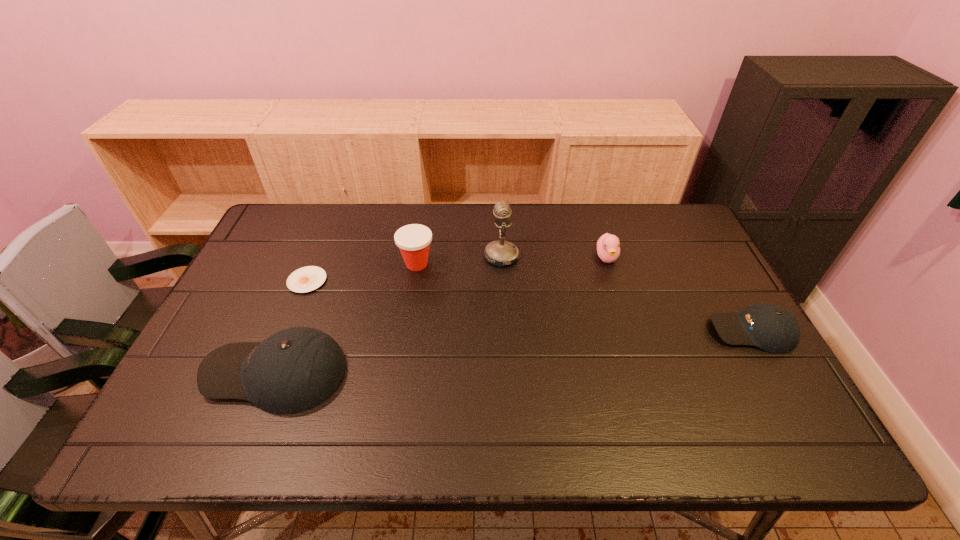
Locate an element on the screen. the left baseball cap is located at coordinates (296, 369).

The height and width of the screenshot is (540, 960). Identify the location of the rightmost object. (770, 327).

The width and height of the screenshot is (960, 540). What are the coordinates of `the second shortest object` in the screenshot? It's located at (770, 327).

Locate an element on the screen. Image resolution: width=960 pixels, height=540 pixels. the second object from right to left is located at coordinates (608, 249).

Find the location of a particular element. This screenshot has width=960, height=540. duckling is located at coordinates point(608,249).

Find the location of a particular element. The height and width of the screenshot is (540, 960). the shortest object is located at coordinates (306, 279).

Find the location of a particular element. The width and height of the screenshot is (960, 540). the third object from right to left is located at coordinates (499, 253).

The height and width of the screenshot is (540, 960). In order to click on the tallest object in this screenshot , I will do `click(499, 253)`.

Locate an element on the screen. Image resolution: width=960 pixels, height=540 pixels. the third object from left to right is located at coordinates (413, 240).

Locate an element on the screen. free space located on the front-facing side of the taller baseball cap is located at coordinates (187, 373).